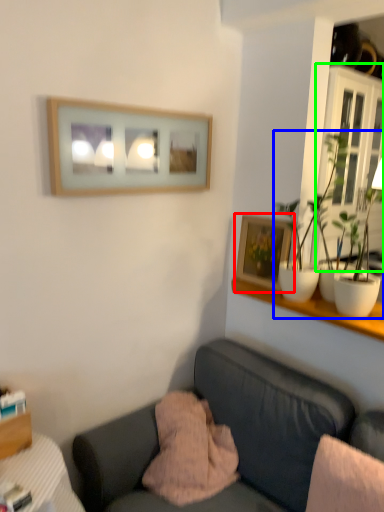
Question: Considering the real-world distances, which object is closest to picture frame (highlighted by a red box)? houseplant (highlighted by a blue box) or window frame (highlighted by a green box).

Choices:
 (A) houseplant
 (B) window frame

Answer: (A)